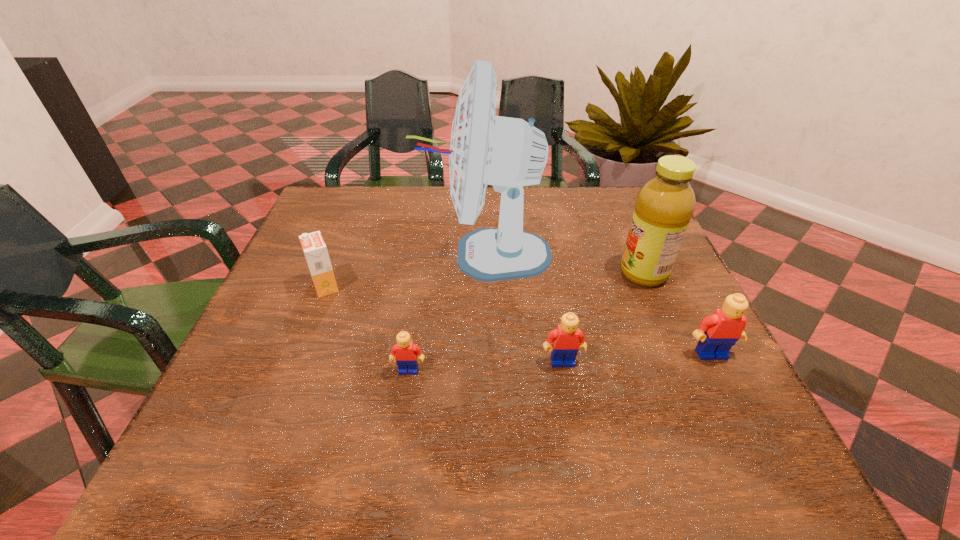
Point out which Lego is positioned as the second nearest to the second Lego from right to left. Please provide its 2D coordinates. Your answer should be formatted as a tuple, i.e. [(x, y)], where the tuple contains the x and y coordinates of a point satisfying the conditions above.

[(405, 353)]

You are a GUI agent. You are given a task and a screenshot of the screen. Output one action in this format:
    pyautogui.click(x=<x>, y=<y>)
    Task: Click on the vacant space that satisfies the following two spatial constraints: 1. on the front label of the fruit juice; 2. on the face of the leftmost Lego
    This screenshot has height=540, width=960.
    Given the screenshot: What is the action you would take?
    pyautogui.click(x=685, y=370)

The image size is (960, 540). What are the coordinates of `free space in the image that satisfies the following two spatial constraints: 1. on the front label of the fruit juice; 2. on the face of the shortest object` in the screenshot? It's located at (685, 370).

This screenshot has width=960, height=540. Find the location of `vacant space that satisfies the following two spatial constraints: 1. on the grille of the tallest object; 2. on the face of the shortest object`. vacant space that satisfies the following two spatial constraints: 1. on the grille of the tallest object; 2. on the face of the shortest object is located at coordinates [x=489, y=370].

This screenshot has width=960, height=540. I want to click on free point that satisfies the following two spatial constraints: 1. on the grille of the tallest object; 2. on the face of the shortest object, so click(x=489, y=370).